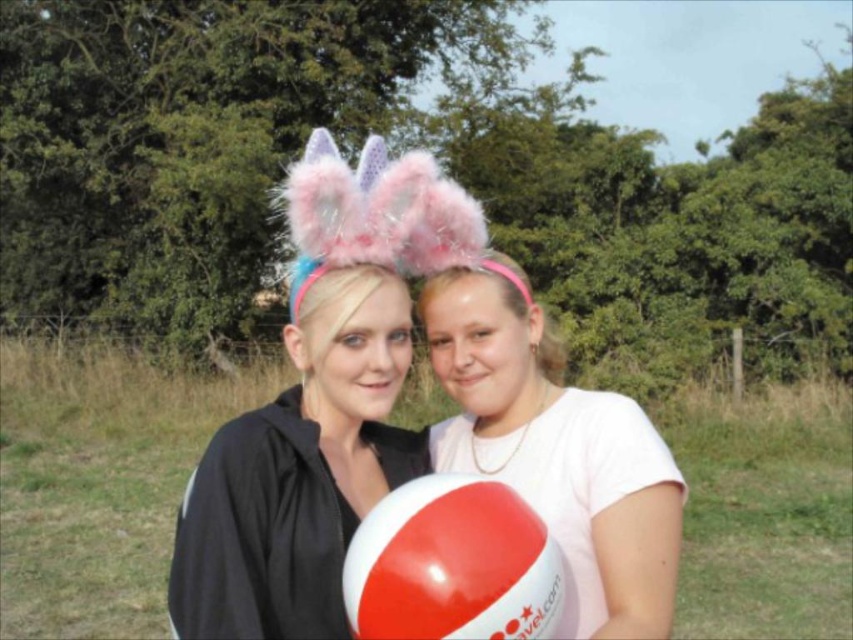
Question: Which object appears farthest from the camera in this image?

Choices:
 (A) white matte balloon at center
 (B) white glossy beach ball at center

Answer: (A)

Question: Does white matte balloon at center appear on the left side of white glossy beach ball at center?

Choices:
 (A) no
 (B) yes

Answer: (A)

Question: From the image, what is the correct spatial relationship of white matte balloon at center in relation to white glossy beach ball at center?

Choices:
 (A) above
 (B) below

Answer: (A)

Question: Is white matte balloon at center further to the viewer compared to white glossy beach ball at center?

Choices:
 (A) no
 (B) yes

Answer: (B)

Question: Among these objects, which one is farthest from the camera?

Choices:
 (A) white matte balloon at center
 (B) white glossy beach ball at center

Answer: (A)